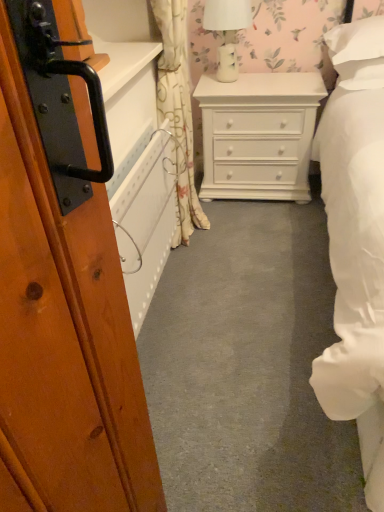
Question: Is white painted wood chest of drawers at center inside or outside of floral fabric curtain at center?

Choices:
 (A) inside
 (B) outside

Answer: (B)

Question: From their relative heights in the image, would you say white painted wood chest of drawers at center is taller or shorter than floral fabric curtain at center?

Choices:
 (A) short
 (B) tall

Answer: (A)

Question: Estimate the real-world distances between objects in this image. Which object is farther from the white glossy table lamp at upper center?

Choices:
 (A) floral fabric curtain at center
 (B) white painted wood chest of drawers at center

Answer: (A)

Question: Estimate the real-world distances between objects in this image. Which object is closer to the white glossy table lamp at upper center?

Choices:
 (A) white painted wood chest of drawers at center
 (B) floral fabric curtain at center

Answer: (A)